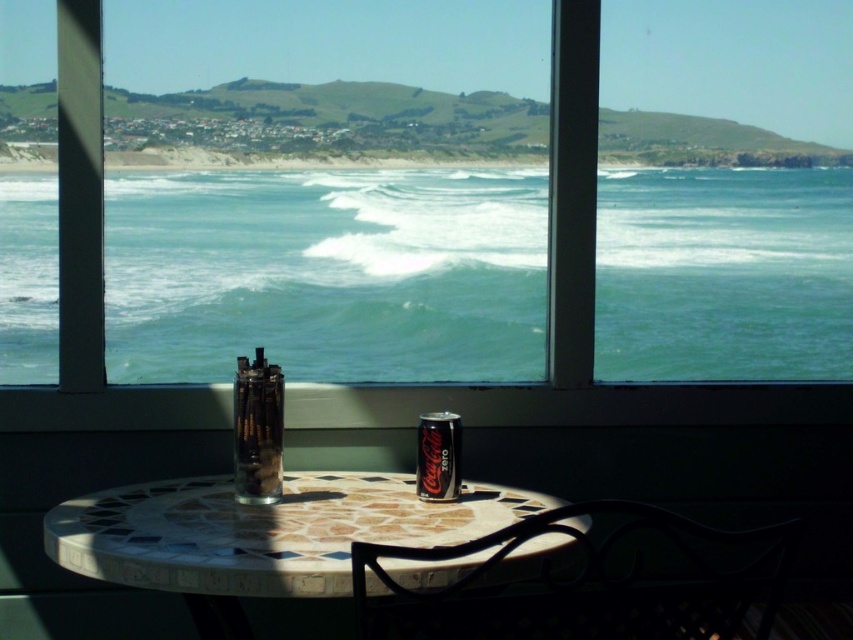
You are a delivery robot with a package that is 14 inches wide. You need to place it between the mosaic tile table at center and the metallic black chair at lower right. Is there enough space for the package?

The mosaic tile table at center and metallic black chair at lower right are 12.53 inches apart from each other. Since the package is 14 inches wide, which is wider than the available space, the package cannot fit between them.

You are planning to place a large potted plant on the mosaic tile table at center and the metallic black chair at lower center. Which object can accommodate the plant better based on their sizes?

The mosaic tile table at center has a larger size compared to the metallic black chair at lower center, so it can accommodate the large potted plant better.